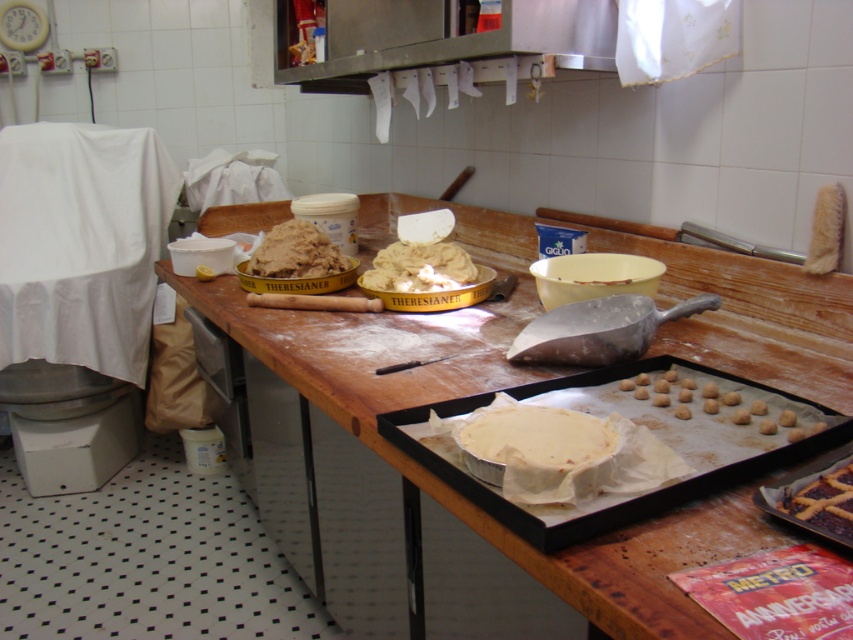
Is point (589, 461) positioned after point (828, 499)?

Yes, point (589, 461) is farther from viewer.

Who is positioned more to the left, white matte pie at center or purple glossy pastry at lower right?

white matte pie at center

Who is more distant from viewer, (x=515, y=448) or (x=836, y=461)?

The point (x=515, y=448) is more distant.

Find the location of a particular element. This screenshot has height=640, width=853. white matte pie at center is located at coordinates (532, 442).

Does soft dough at center appear over purple glossy pastry at lower right?

Yes.

Is soft dough at center below purple glossy pastry at lower right?

Incorrect, soft dough at center is not positioned below purple glossy pastry at lower right.

The image size is (853, 640). What do you see at coordinates (419, 268) in the screenshot?
I see `soft dough at center` at bounding box center [419, 268].

The height and width of the screenshot is (640, 853). In order to click on soft dough at center in this screenshot , I will do `click(419, 268)`.

What do you see at coordinates (469, 394) in the screenshot?
I see `wooden table at center` at bounding box center [469, 394].

Find the location of a particular element. wooden table at center is located at coordinates (x=469, y=394).